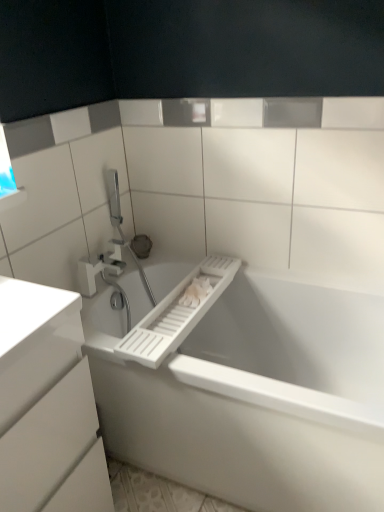
Question: From a real-world perspective, is white plastic tap at upper left positioned under white plastic towel bar at center based on gravity?

Choices:
 (A) yes
 (B) no

Answer: (B)

Question: Is white plastic tap at upper left positioned in front of white plastic towel bar at center?

Choices:
 (A) no
 (B) yes

Answer: (A)

Question: Considering the relative sizes of white plastic tap at upper left and white plastic towel bar at center in the image provided, is white plastic tap at upper left bigger than white plastic towel bar at center?

Choices:
 (A) yes
 (B) no

Answer: (B)

Question: Is white plastic tap at upper left to the right of white plastic towel bar at center from the viewer's perspective?

Choices:
 (A) no
 (B) yes

Answer: (A)

Question: Can you confirm if white plastic tap at upper left is positioned to the left of white plastic towel bar at center?

Choices:
 (A) no
 (B) yes

Answer: (B)

Question: Do you think white glossy cabinet at lower left is within white plastic tap at upper left, or outside of it?

Choices:
 (A) outside
 (B) inside

Answer: (A)

Question: From the image's perspective, relative to white plastic tap at upper left, is white glossy cabinet at lower left above or below?

Choices:
 (A) above
 (B) below

Answer: (B)

Question: From a real-world perspective, relative to white plastic tap at upper left, is white glossy cabinet at lower left vertically above or below?

Choices:
 (A) below
 (B) above

Answer: (A)

Question: Is point (0, 398) closer or farther from the camera than point (120, 258)?

Choices:
 (A) closer
 (B) farther

Answer: (A)

Question: Looking at the image, does white plastic bathtub at lower left seem bigger or smaller compared to white plastic towel bar at center?

Choices:
 (A) big
 (B) small

Answer: (A)

Question: Would you say white plastic bathtub at lower left is to the left or to the right of white plastic towel bar at center in the picture?

Choices:
 (A) right
 (B) left

Answer: (A)

Question: From the image's perspective, is white plastic bathtub at lower left positioned above or below white plastic towel bar at center?

Choices:
 (A) above
 (B) below

Answer: (B)

Question: Considering the positions of white plastic bathtub at lower left and white plastic towel bar at center in the image, is white plastic bathtub at lower left taller or shorter than white plastic towel bar at center?

Choices:
 (A) short
 (B) tall

Answer: (B)

Question: Is white plastic towel bar at center bigger or smaller than white plastic bathtub at lower left?

Choices:
 (A) big
 (B) small

Answer: (B)

Question: Is white plastic towel bar at center inside or outside of white plastic bathtub at lower left?

Choices:
 (A) inside
 (B) outside

Answer: (A)